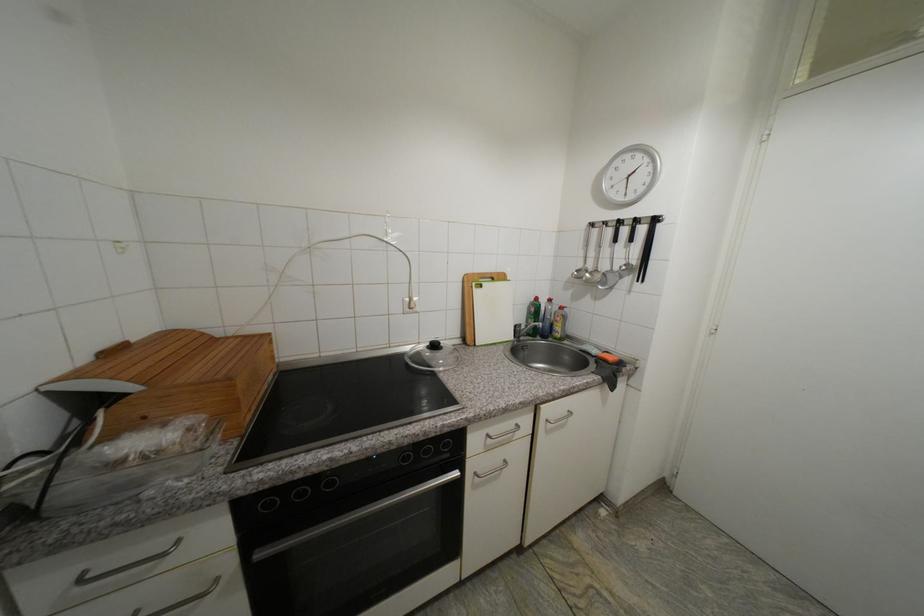
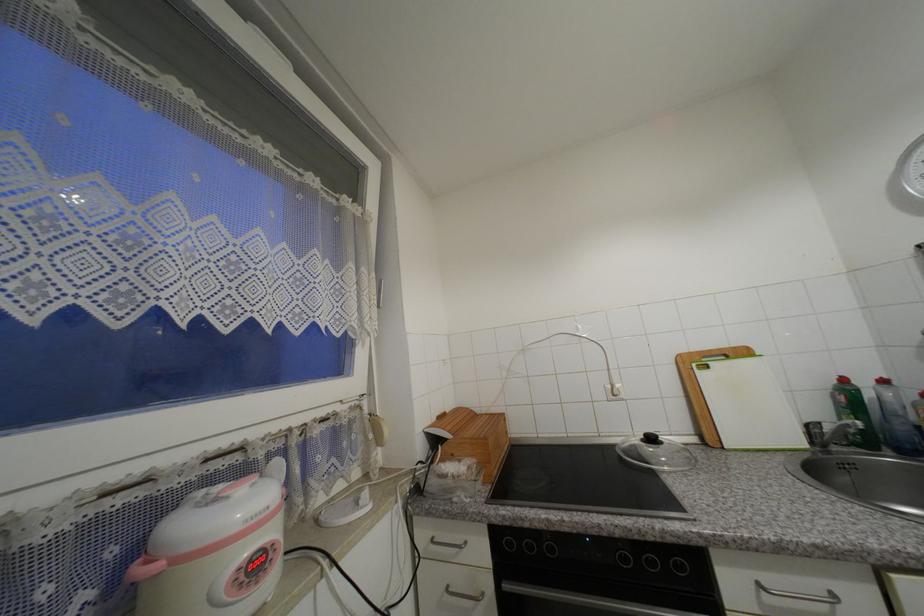
Where in the second image is the point corresponding to (x=480, y=285) from the first image?

(699, 367)